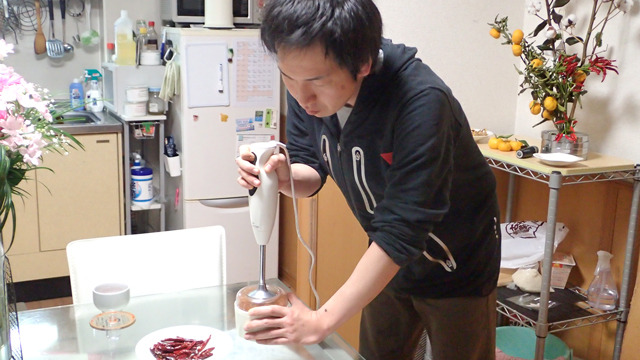
This screenshot has width=640, height=360. In order to click on blender in this screenshot , I will do `click(260, 291)`.